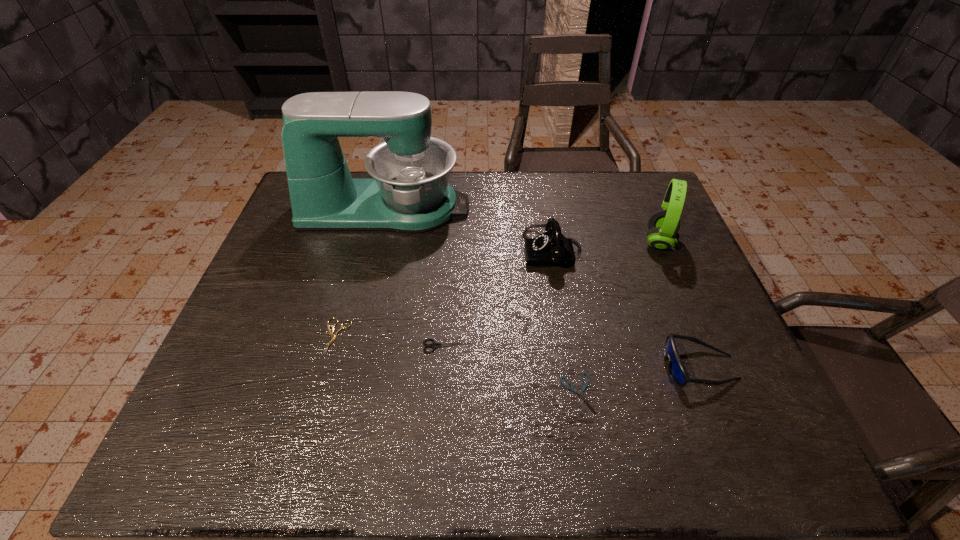
Identify the location of free space between the leftmost shears and the mixer. The height and width of the screenshot is (540, 960). (361, 273).

Where is `unoccupied position between the fourth shortest object and the headset`? unoccupied position between the fourth shortest object and the headset is located at coordinates (679, 305).

Image resolution: width=960 pixels, height=540 pixels. I want to click on vacant area that lies between the shortest shears and the mixer, so click(481, 301).

I want to click on unoccupied position between the second tallest object and the tallest shears, so click(553, 294).

In order to click on vacant region between the fifth shortest object and the sixth shortest object in this screenshot , I will do `click(606, 246)`.

Locate an element on the screen. free space between the nearest shears and the mixer is located at coordinates (481, 301).

Identify the location of unoccupied area between the rightmost shears and the fourth shortest object. (638, 381).

Locate an element on the screen. This screenshot has width=960, height=540. free space between the tallest object and the telephone is located at coordinates (469, 230).

Locate an element on the screen. unoccupied area between the third tallest object and the second shortest object is located at coordinates (444, 294).

At what (x,y) coordinates should I click in order to perform the action: click on the sixth closest object relative to the tallest shears. Please return your answer as a coordinate pair (x, y). Image resolution: width=960 pixels, height=540 pixels. Looking at the image, I should click on (663, 225).